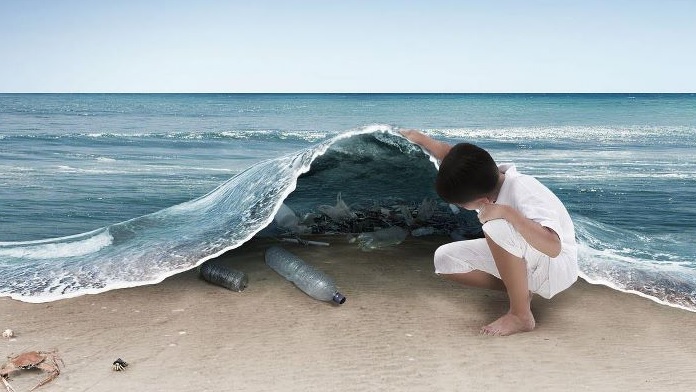
The height and width of the screenshot is (392, 696). In order to click on blanket in this screenshot , I will do `click(351, 212)`.